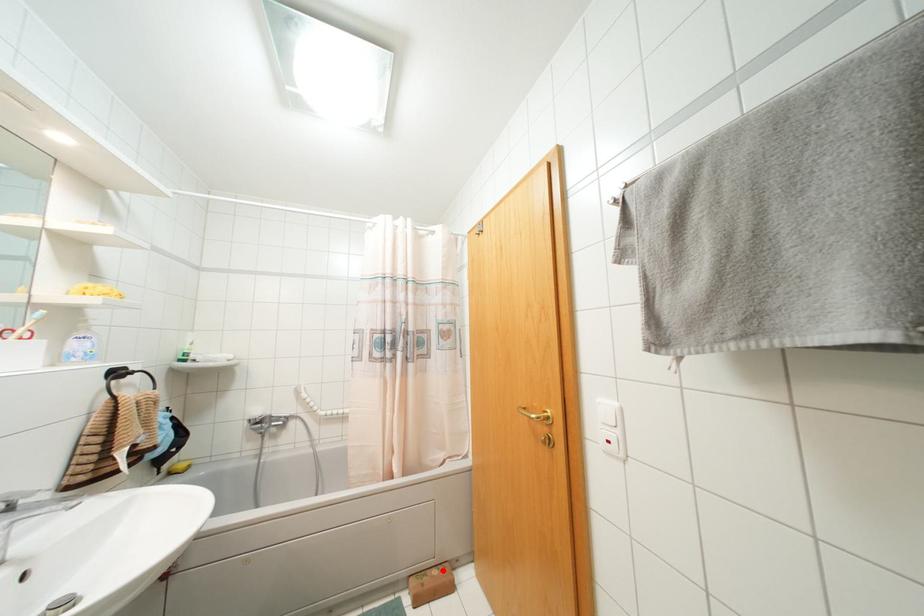
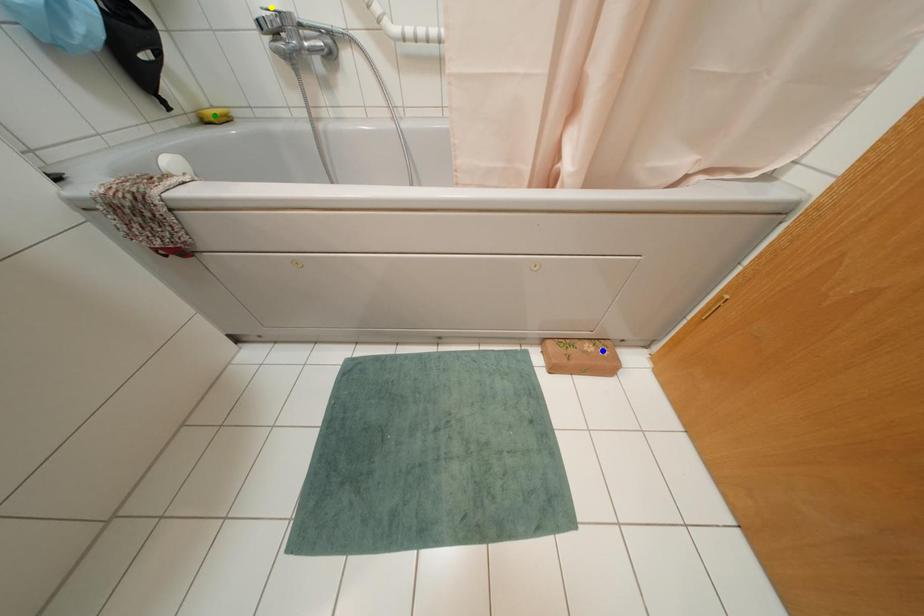
Question: I am providing you with two images of the same scene from different viewpoints. A red point is marked on the first image. You are given multiple points on the second image. Can you choose the point in image 2 that corresponds to the point in image 1?

Choices:
 (A) green point
 (B) blue point
 (C) yellow point

Answer: (B)